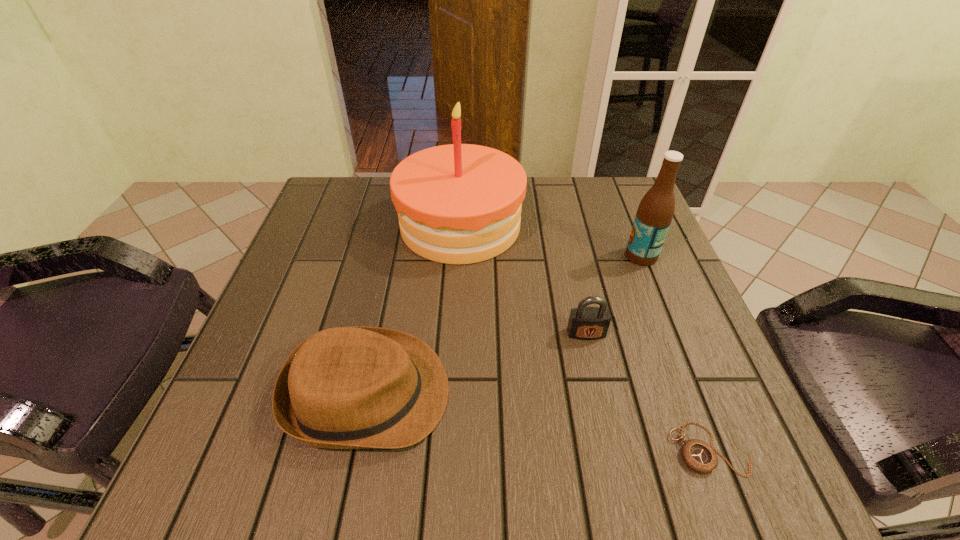
Locate an element on the screen. This screenshot has width=960, height=540. object that is positioned at the far edge is located at coordinates (459, 203).

At what (x,y) coordinates should I click in order to perform the action: click on fedora that is positioned at the near edge. Please return your answer as a coordinate pair (x, y). Looking at the image, I should click on (346, 387).

Locate an element on the screen. The height and width of the screenshot is (540, 960). pocket watch situated at the near edge is located at coordinates (699, 456).

In order to click on object present at the left edge in this screenshot , I will do `click(346, 387)`.

Find the location of a particular element. The width and height of the screenshot is (960, 540). beer bottle that is positioned at the right edge is located at coordinates (655, 212).

This screenshot has width=960, height=540. I want to click on pocket watch located at the right edge, so click(x=699, y=456).

The height and width of the screenshot is (540, 960). What are the coordinates of `object present at the near left corner` in the screenshot? It's located at (346, 387).

Locate an element on the screen. object at the near right corner is located at coordinates (699, 456).

At what (x,y) coordinates should I click in order to perform the action: click on vacant space at the far edge. Please return your answer as a coordinate pair (x, y). Looking at the image, I should click on tap(576, 219).

This screenshot has width=960, height=540. Identify the location of vacant space at the near edge. (457, 457).